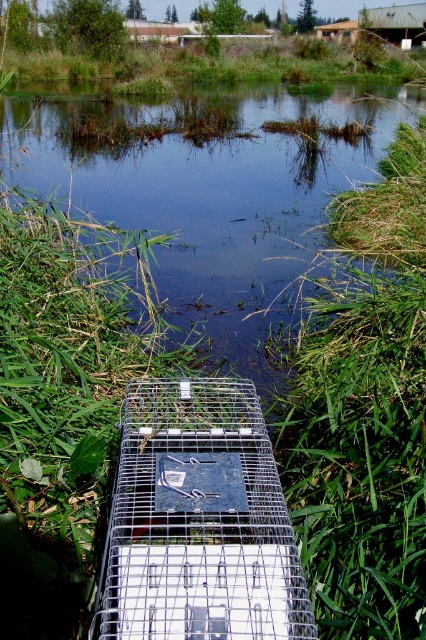
Consider the image. You are standing in the middle of the green grassy pond at center and want to reach the silver metallic birdcage at center. Which direction should you move to get there?

You should move to your right because the green grassy pond at center is to the left of the silver metallic birdcage at center.

You are a bird flying at a low altitude over the marshy area. You notice the silver metallic birdcage at center and the green grass at upper center. Which object is shorter in height?

The silver metallic birdcage at center has a lesser height compared to the green grass at upper center, so the silver metallic birdcage at center is shorter.

You are standing at the edge of the water in this marshy area and see two points marked on the ground. The first point is at coordinates point (x=169, y=227) and the second is at point (x=307, y=74). If you were to walk from your current position towards the water, which point would you encounter first?

Point (x=169, y=227) is in front of point (x=307, y=74), so you would encounter point (x=169, y=227) first as you walk towards the water.